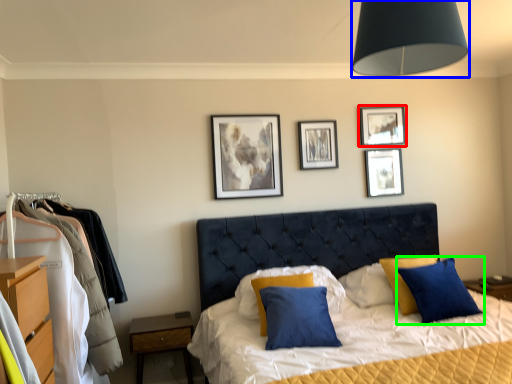
Question: Which object is positioned closest to picture frame (highlighted by a red box)? Select from light fixture (highlighted by a blue box) and pillow (highlighted by a green box).

Choices:
 (A) light fixture
 (B) pillow

Answer: (B)